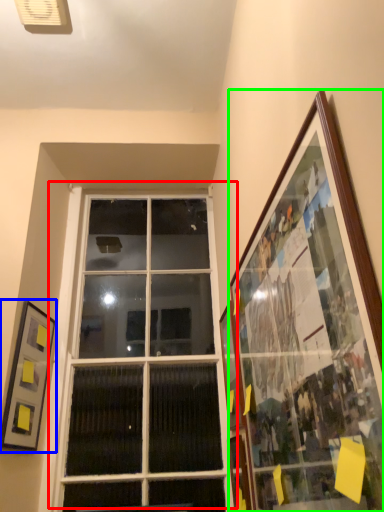
Question: Considering the real-world distances, which object is closest to window (highlighted by a red box)? picture frame (highlighted by a blue box) or picture frame (highlighted by a green box).

Choices:
 (A) picture frame
 (B) picture frame

Answer: (A)